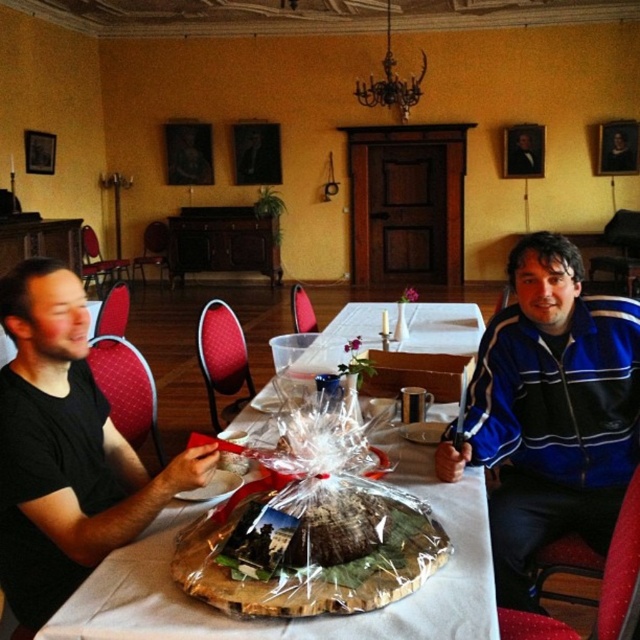
In the dining room scene, there is a black matte shirt at left and a translucent plastic cake at center. Which object is wider when viewed from above?

The translucent plastic cake at center is wider than the black matte shirt at left.

You are standing in the dining room and need to hand a tool to the person wearing the blue striped jacket at right. Based on their position, which direction should you approach from?

The blue striped jacket at right is located at point [550,412], so you should approach from the left side to reach them effectively.